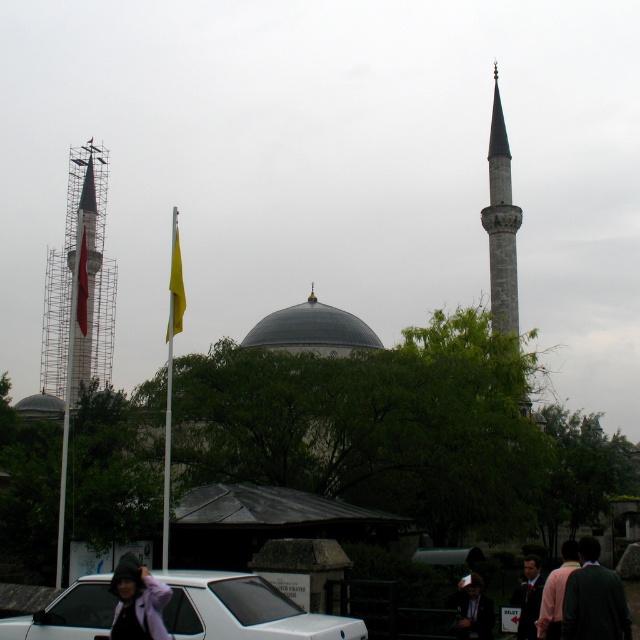
You are a tourist standing at the entrance of the park near the small structure with a sloped roof. You want to take a photo of the gray stone minaret at right and the dark gray suit at lower right. Which object should you focus on first if you want to capture both in the same frame without moving your camera?

The gray stone minaret at right is bigger than the dark gray suit at lower right, so you should focus on the gray stone minaret at right first to ensure it fits properly in the frame before adjusting for the smaller dark gray suit at lower right.

You are standing in the park area near the small structure with a sloped roof and want to take a photo of both the gray stone minaret at right and the dark green jacket at lower right. Which object should you adjust your camera focus on first to ensure both are in the same frame?

The gray stone minaret at right is further to the viewer than the dark green jacket at lower right, so you should focus on the gray stone minaret at right first to ensure both are in the same frame.

You are standing at the entrance of the park and want to take a photo of the mosque. There are two points marked in the scene. The first point is at coordinates point (513, 257), and the second point is at point (525, 572). Which point is closer to you, the observer, so that you can focus on it for better framing?

Point (513, 257) is closer to you than point (525, 572), so you should focus on point (513, 257) for better framing.